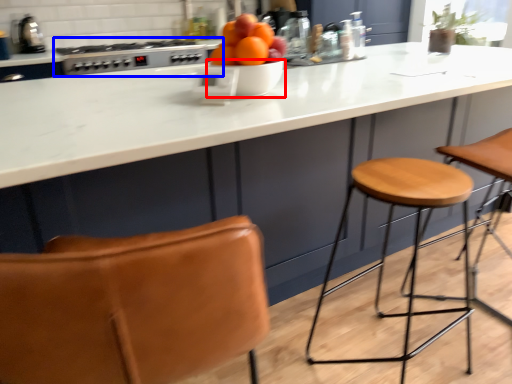
Question: Which object appears closest to the camera in this image, bowl (highlighted by a red box) or gas stove (highlighted by a blue box)?

Choices:
 (A) bowl
 (B) gas stove

Answer: (A)